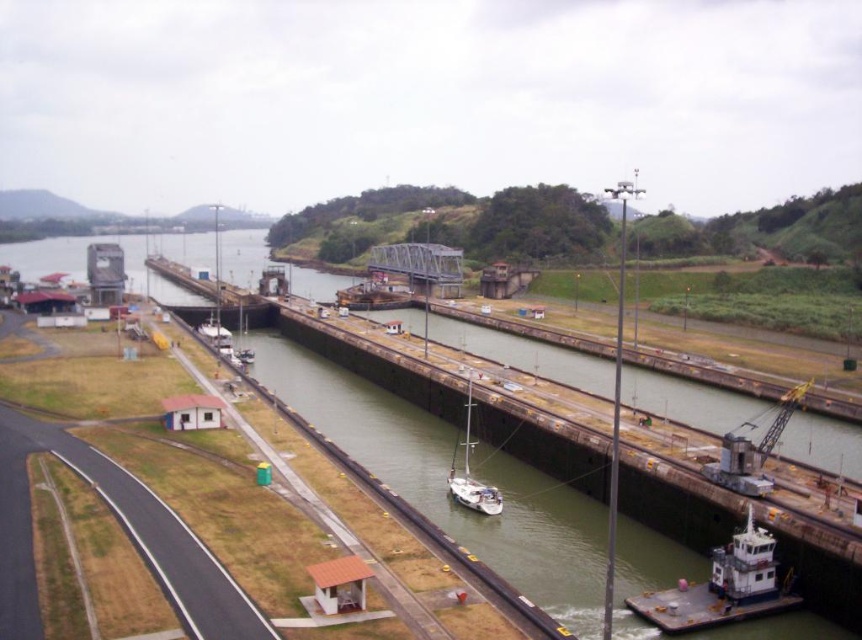
Question: Is white matte tugboat at lower right to the right of white matte sailboat at center from the viewer's perspective?

Choices:
 (A) yes
 (B) no

Answer: (A)

Question: Where is white matte tugboat at lower right located in relation to white matte sailboat at center in the image?

Choices:
 (A) below
 (B) above

Answer: (A)

Question: Is white matte tugboat at lower right thinner than white matte sailboat at center?

Choices:
 (A) no
 (B) yes

Answer: (B)